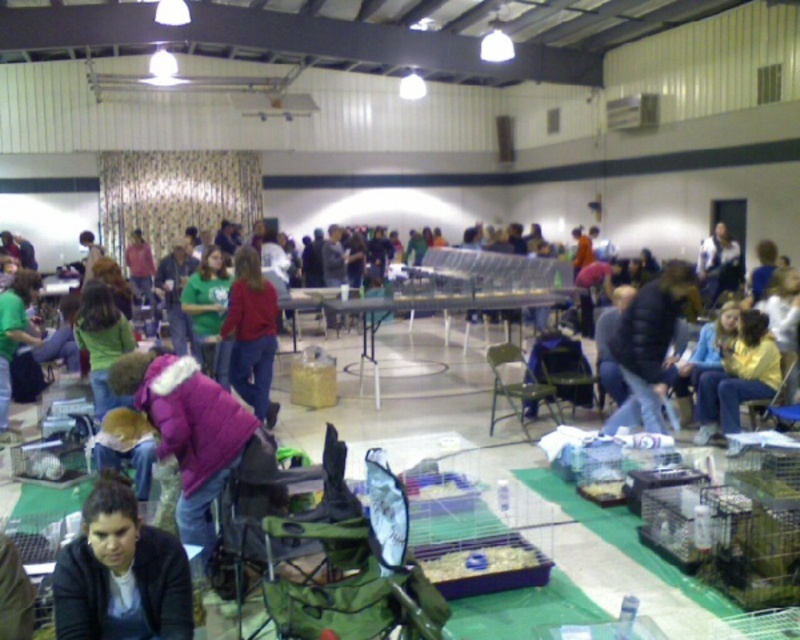
Who is shorter, white plastic table at center or yellow jacket at lower right?

white plastic table at center

Is white plastic table at center below yellow jacket at lower right?

No.

I want to click on white plastic table at center, so click(424, 312).

At what (x,y) coordinates should I click in order to perform the action: click on white plastic table at center. Please return your answer as a coordinate pair (x, y). This screenshot has width=800, height=640. Looking at the image, I should click on (424, 312).

At what (x,y) coordinates should I click in order to perform the action: click on white plastic table at center. Please return your answer as a coordinate pair (x, y). Looking at the image, I should click on (424, 312).

Identify the location of white plastic table at center. This screenshot has width=800, height=640. (424, 312).

Describe the element at coordinates (252, 333) in the screenshot. This screenshot has width=800, height=640. I see `matte red shirt at center` at that location.

Is matte red shirt at center thinner than yellow jacket at lower right?

Yes, matte red shirt at center is thinner than yellow jacket at lower right.

In order to click on matte red shirt at center in this screenshot , I will do `click(252, 333)`.

This screenshot has width=800, height=640. In order to click on matte red shirt at center in this screenshot , I will do `click(252, 333)`.